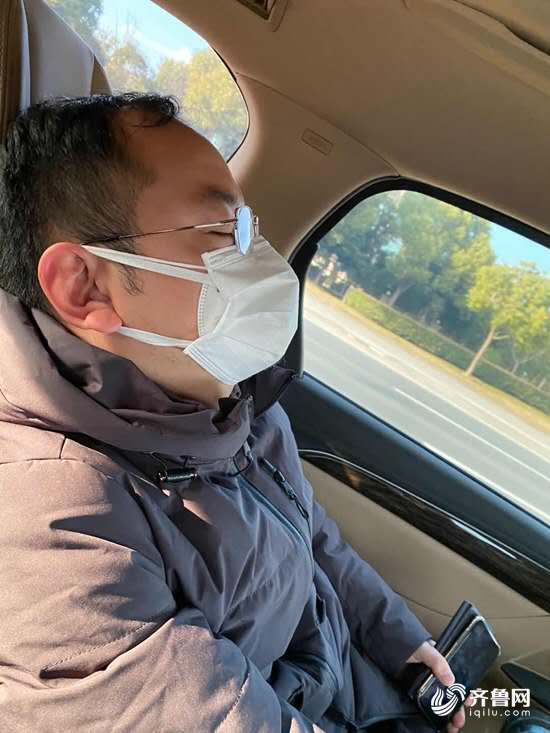
Locate an element on the screen. This screenshot has width=550, height=733. phone is located at coordinates (483, 658).